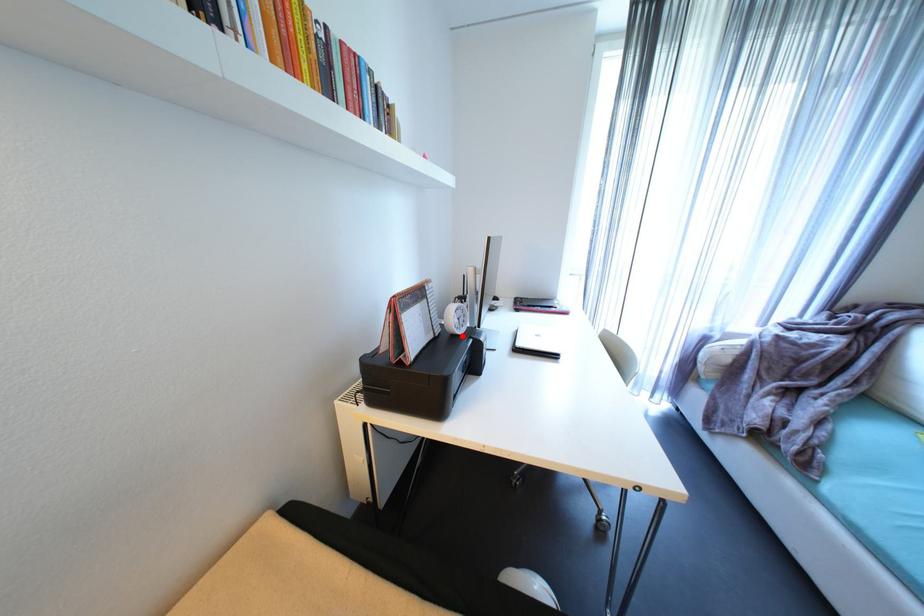
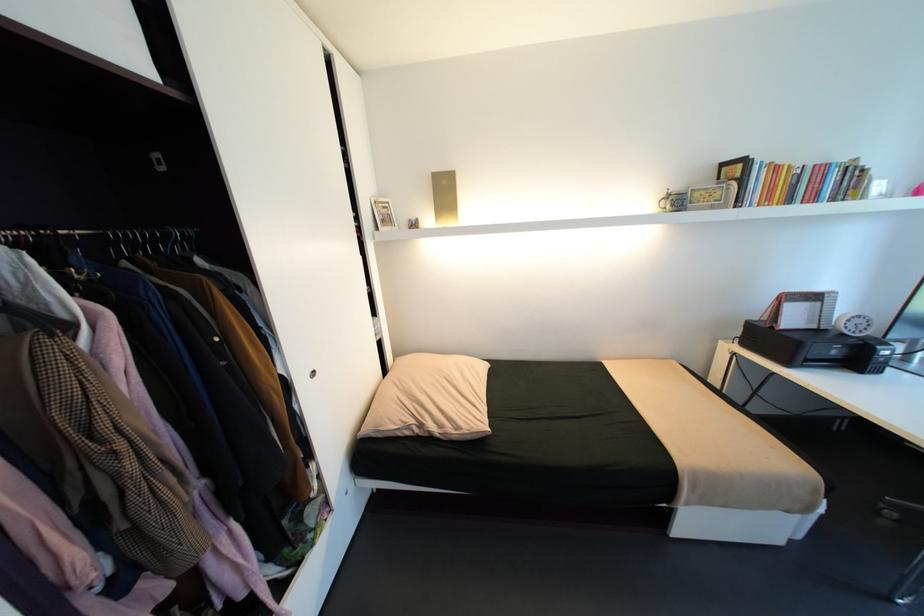
The point at the highlighted location is marked in the first image. Where is the corresponding point in the second image?

(850, 334)